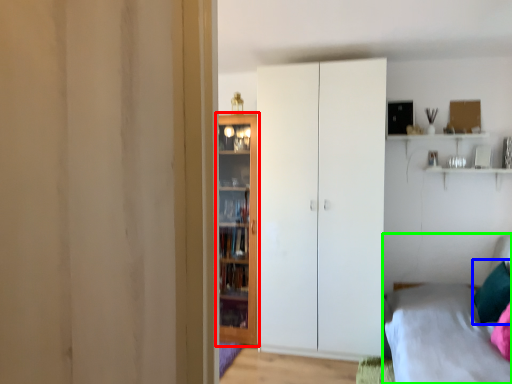
Question: Based on their relative distances, which object is farther from door (highlighted by a red box)? Choose from pillow (highlighted by a blue box) and bed (highlighted by a green box).

Choices:
 (A) pillow
 (B) bed

Answer: (A)